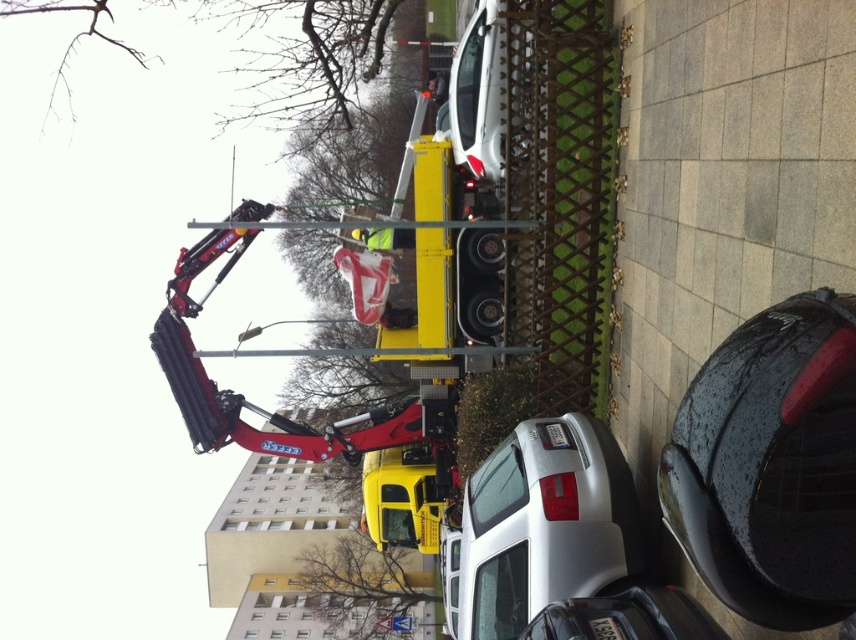
Question: Is satin silver car at center positioned behind yellow matte truck at center?

Choices:
 (A) yes
 (B) no

Answer: (B)

Question: Which of the following is the farthest from the observer?

Choices:
 (A) satin silver car at center
 (B) yellow matte truck at center

Answer: (B)

Question: Does satin silver car at center have a lesser width compared to yellow matte truck at center?

Choices:
 (A) yes
 (B) no

Answer: (B)

Question: Is satin silver car at center closer to camera compared to yellow matte truck at center?

Choices:
 (A) yes
 (B) no

Answer: (A)